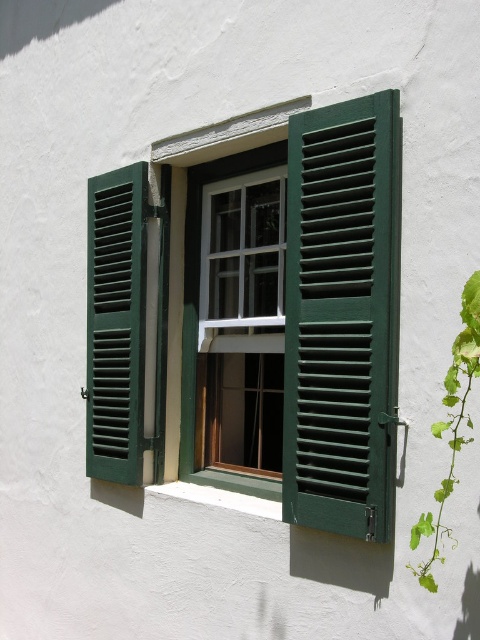
Question: Is green painted wood shutter at center thinner than green painted wood shutters at left?

Choices:
 (A) yes
 (B) no

Answer: (B)

Question: Which point is closer to the camera?

Choices:
 (A) (121, 205)
 (B) (261, 513)
 (C) (450, 483)
 (D) (305, 156)

Answer: (C)

Question: Considering the real-world distances, which object is closest to the green leafy vine at right?

Choices:
 (A) white concrete at lower center
 (B) green painted wood shutter at center

Answer: (B)

Question: Is green painted wood shutter at center thinner than white concrete at lower center?

Choices:
 (A) yes
 (B) no

Answer: (A)

Question: Which object is farther from the camera taking this photo?

Choices:
 (A) green painted wood shutter at center
 (B) green leafy vine at right
 (C) white concrete at lower center
 (D) green painted wood shutters at left

Answer: (D)

Question: Is green painted wood shutters at left above white concrete at lower center?

Choices:
 (A) yes
 (B) no

Answer: (A)